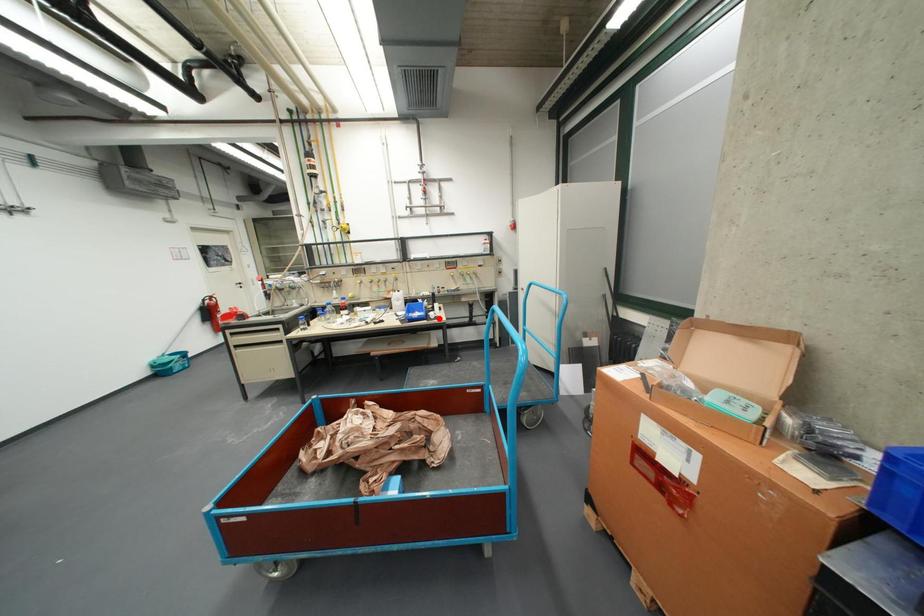
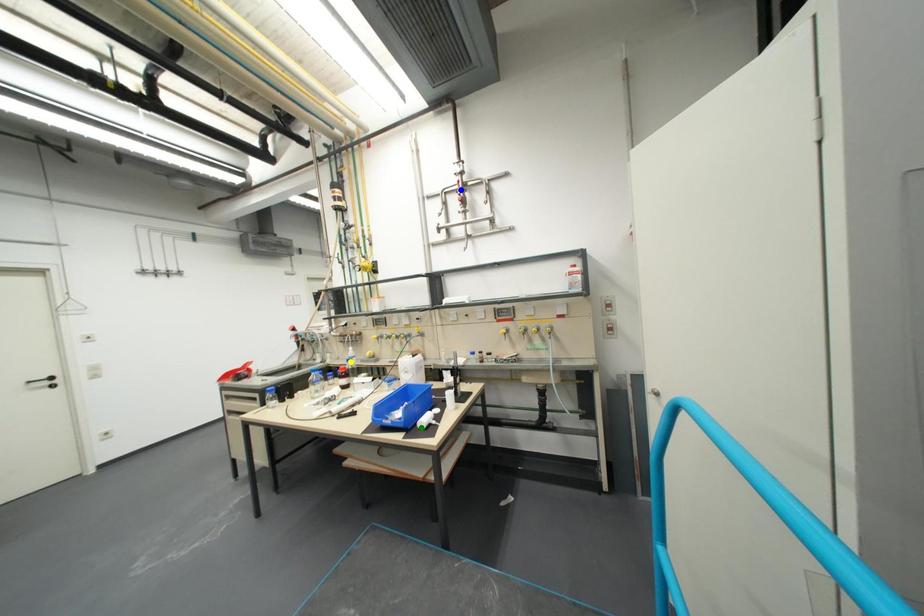
Question: I am providing you with two images of the same scene from different viewpoints. A red point is marked on the first image. You are given multiple points on the second image. In image 2, which mark is for the same physical point as the one in image 1?

Choices:
 (A) green point
 (B) blue point
 (C) yellow point

Answer: (A)